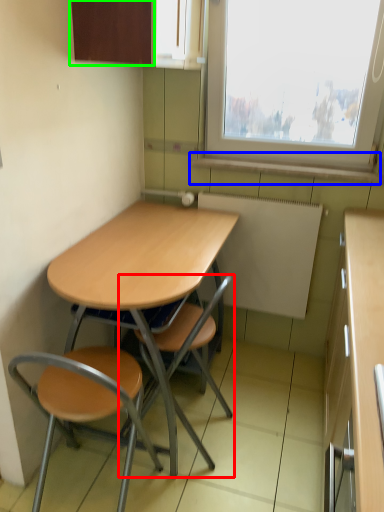
Question: Based on their relative distances, which object is farther from chair (highlighted by a red box)? Choose from window sill (highlighted by a blue box) and cabinetry (highlighted by a green box).

Choices:
 (A) window sill
 (B) cabinetry

Answer: (B)